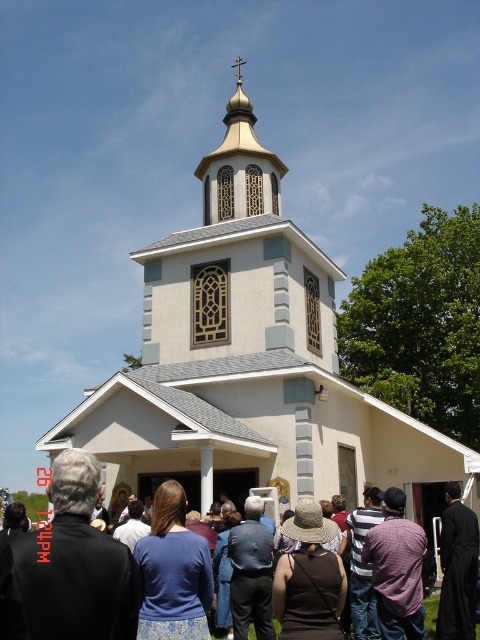
Can you confirm if white stucco church at center is thinner than brown fabric crowd at center?

In fact, white stucco church at center might be wider than brown fabric crowd at center.

Is white stucco church at center bigger than brown fabric crowd at center?

Yes, white stucco church at center is bigger than brown fabric crowd at center.

Locate an element on the screen. The height and width of the screenshot is (640, 480). white stucco church at center is located at coordinates (249, 364).

This screenshot has height=640, width=480. Find the location of `white stucco church at center`. white stucco church at center is located at coordinates (249, 364).

Is white stucco church at center positioned before gold textured dome at upper center?

Yes.

Can you confirm if white stucco church at center is positioned to the right of gold textured dome at upper center?

Yes, white stucco church at center is to the right of gold textured dome at upper center.

Is point (257, 148) positioned in front of point (271, 170)?

Yes, point (257, 148) is in front of point (271, 170).

What are the coordinates of `white stucco church at center` in the screenshot? It's located at (249, 364).

This screenshot has width=480, height=640. Describe the element at coordinates (68, 568) in the screenshot. I see `brown fabric crowd at center` at that location.

Locate an element on the screen. brown fabric crowd at center is located at coordinates (68, 568).